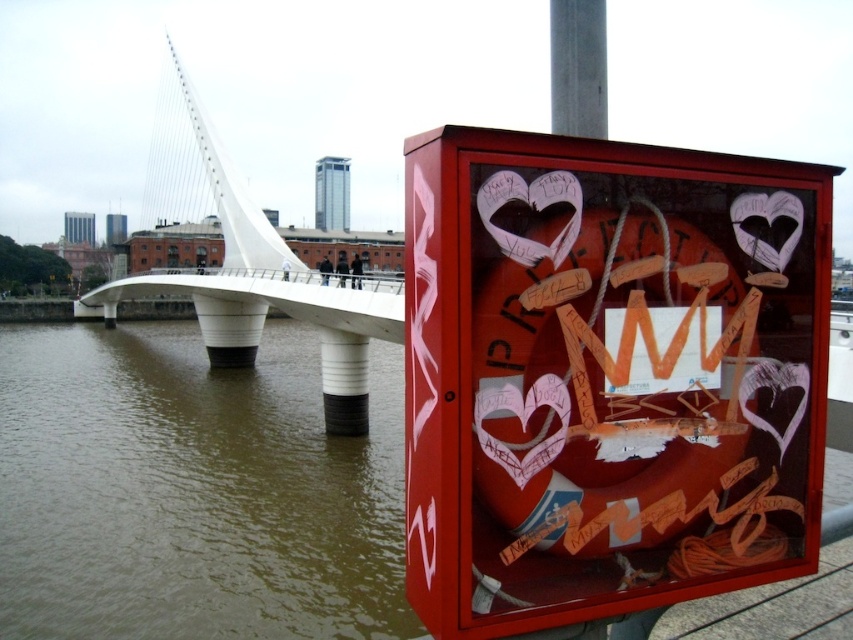
Is white matte bridge at upper center thinner than smooth concrete pole at upper center?

No.

Between white matte bridge at upper center and smooth concrete pole at upper center, which one has less height?

With less height is smooth concrete pole at upper center.

Is point (323, 368) farther from viewer compared to point (593, 74)?

Yes, point (323, 368) is farther from viewer.

Locate an element on the screen. Image resolution: width=853 pixels, height=640 pixels. white matte bridge at upper center is located at coordinates (265, 291).

What do you see at coordinates (193, 490) in the screenshot? This screenshot has width=853, height=640. I see `brown murky water at lower left` at bounding box center [193, 490].

Does brown murky water at lower left appear on the right side of smooth concrete pole at upper center?

Incorrect, brown murky water at lower left is not on the right side of smooth concrete pole at upper center.

You are a GUI agent. You are given a task and a screenshot of the screen. Output one action in this format:
    pyautogui.click(x=<x>, y=<y>)
    Task: Click on the brown murky water at lower left
    The image size is (853, 640).
    Given the screenshot: What is the action you would take?
    pyautogui.click(x=193, y=490)

Does shiny red box at center have a larger size compared to white matte bridge at upper center?

Incorrect, shiny red box at center is not larger than white matte bridge at upper center.

Is shiny red box at center further to camera compared to white matte bridge at upper center?

No, it is not.

Identify the location of shiny red box at center. (607, 376).